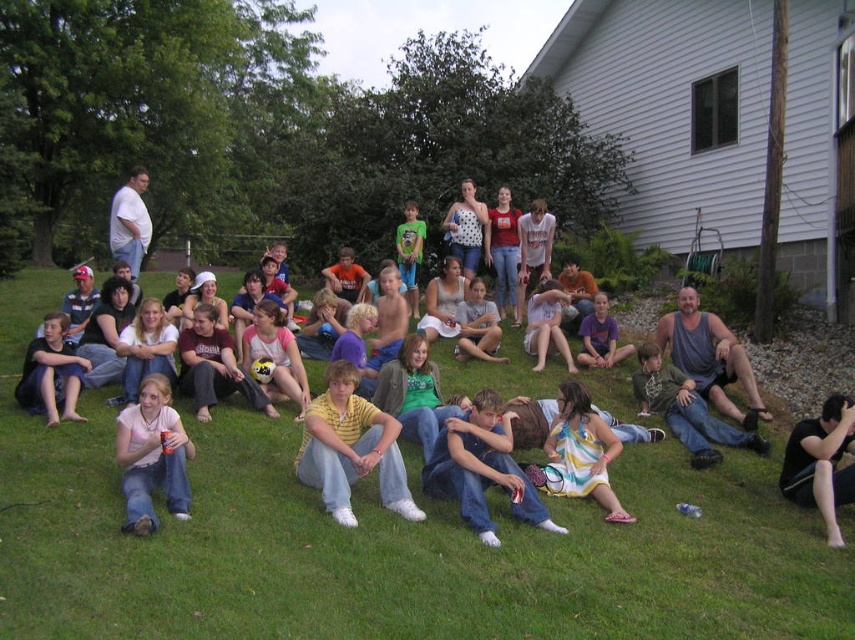
Does black cotton shirt at lower right have a smaller size compared to light gray cotton shirt at center?

Correct, black cotton shirt at lower right occupies less space than light gray cotton shirt at center.

Which is below, black cotton shirt at lower right or light gray cotton shirt at center?

black cotton shirt at lower right is below.

Is point (848, 490) closer to camera compared to point (475, 310)?

Yes, point (848, 490) is in front of point (475, 310).

This screenshot has width=855, height=640. What are the coordinates of `black cotton shirt at lower right` in the screenshot? It's located at (821, 461).

Who is more distant from viewer, (146, 529) or (720, 404)?

Positioned behind is point (720, 404).

Which is above, pink fabric shirt at lower left or gray tank top at center?

gray tank top at center is higher up.

Between point (156, 470) and point (674, 356), which one is positioned behind?

The point (674, 356) is more distant.

The width and height of the screenshot is (855, 640). Identify the location of pink fabric shirt at lower left. (152, 456).

Does green grass at center have a lesser height compared to black cotton shirt at lower right?

→ No, green grass at center is not shorter than black cotton shirt at lower right.

Does green grass at center appear on the left side of black cotton shirt at lower right?

Yes, green grass at center is to the left of black cotton shirt at lower right.

What are the coordinates of `green grass at center` in the screenshot? It's located at (386, 544).